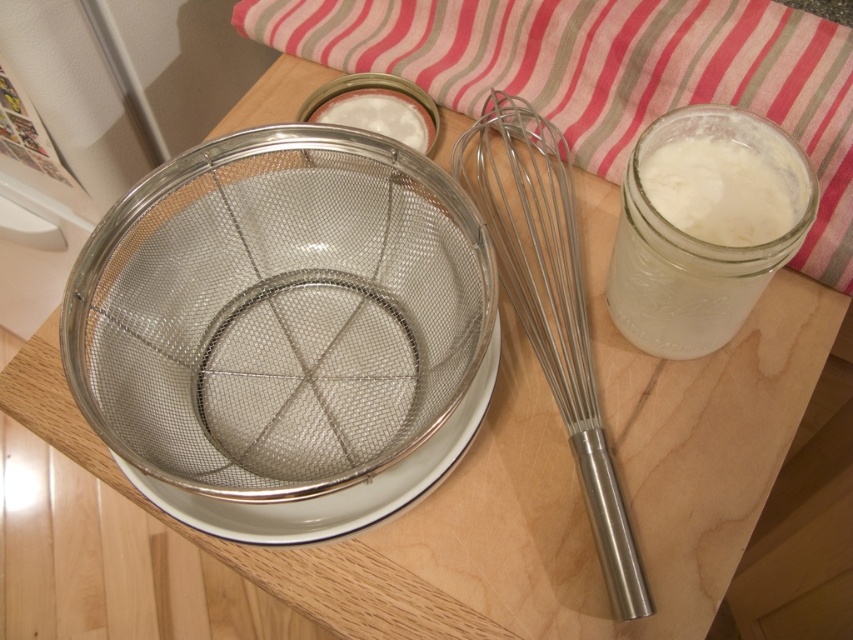
You are a chef preparing a dessert and need to reach for the metallic silver whisk at center. However, there is a metallic mesh strainer at center in the way. Can you easily access the whisk without moving the strainer?

The metallic mesh strainer at center is closer to the viewer than the metallic silver whisk at center, so you cannot easily access the whisk without moving the strainer.

You are a chef holding a spatula that is 12 inches long. You want to place the spatula on the counter between the metallic mesh strainer at center and a nearby object. Which object should you place it closer to to ensure it fits without overhanging the edge?

The metallic mesh strainer at center is 18.27 inches from the camera, so placing the 12 inch spatula closer to it would ensure it fits without overhanging the edge.

You are a baker preparing ingredients and need to pour the white opaque liquid at right into the metallic mesh strainer at center. Can you do this without moving either object?

Result: The metallic mesh strainer at center is located below the white opaque liquid at right, so pouring the liquid into the strainer would require moving the strainer upwards or the liquid downwards, which isn